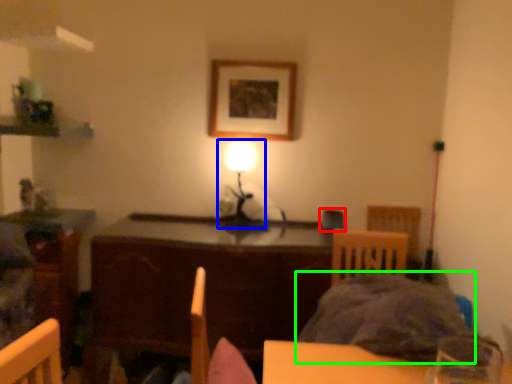
Question: Based on their relative distances, which object is nearer to armchair (highlighted by a red box)? Choose from table lamp (highlighted by a blue box) and bedding (highlighted by a green box).

Choices:
 (A) table lamp
 (B) bedding

Answer: (A)